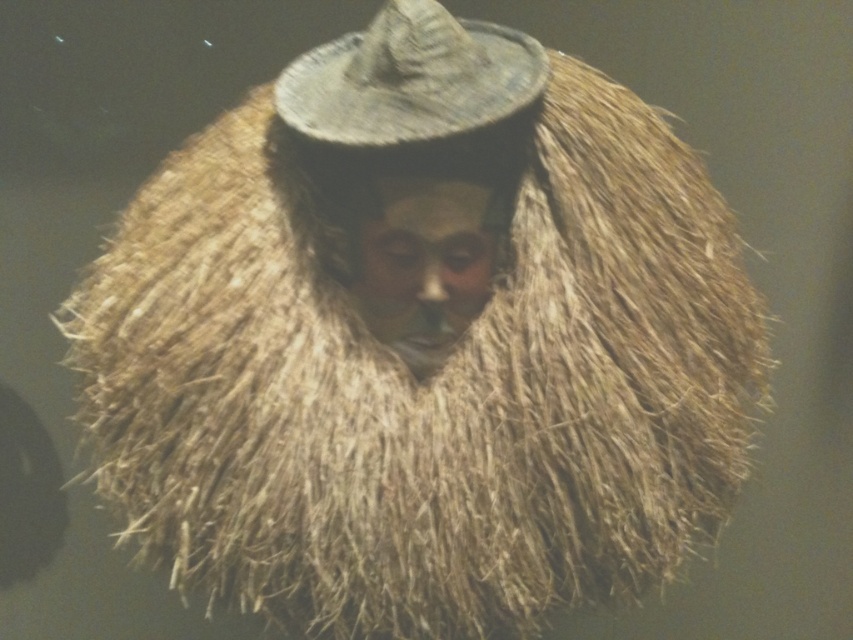
Consider the image. You are an artist trying to sketch this figure. You notice the natural straw hat at center and the smooth tan face at center. Which object is positioned to the right side of the other?

The natural straw hat at center is to the left of smooth tan face at center, so the smooth tan face at center is positioned to the right of the natural straw hat at center.

You are a photographer trying to capture the figure in the scene. You notice two points marked in the image. Which point, point (369, 33) or point (387, 339), is closer to your camera lens?

Point (369, 33) is closer to the camera lens than point (387, 339).

You are an artist trying to draw the figure in the image. You want to ensure the proportions are accurate. Which object, the natural straw hat at center or the smooth tan face at center, is shorter?

The natural straw hat at center is shorter than the smooth tan face at center according to the description.